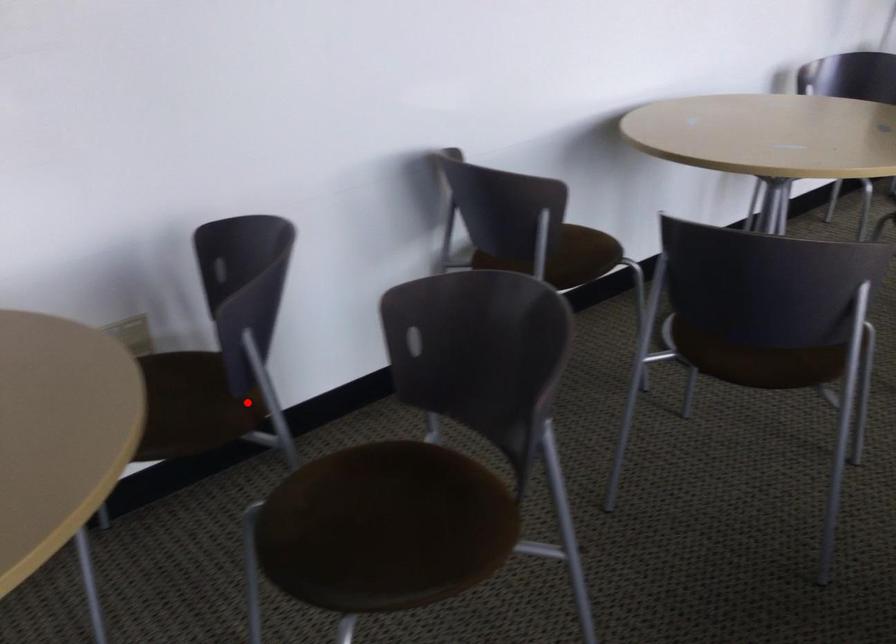
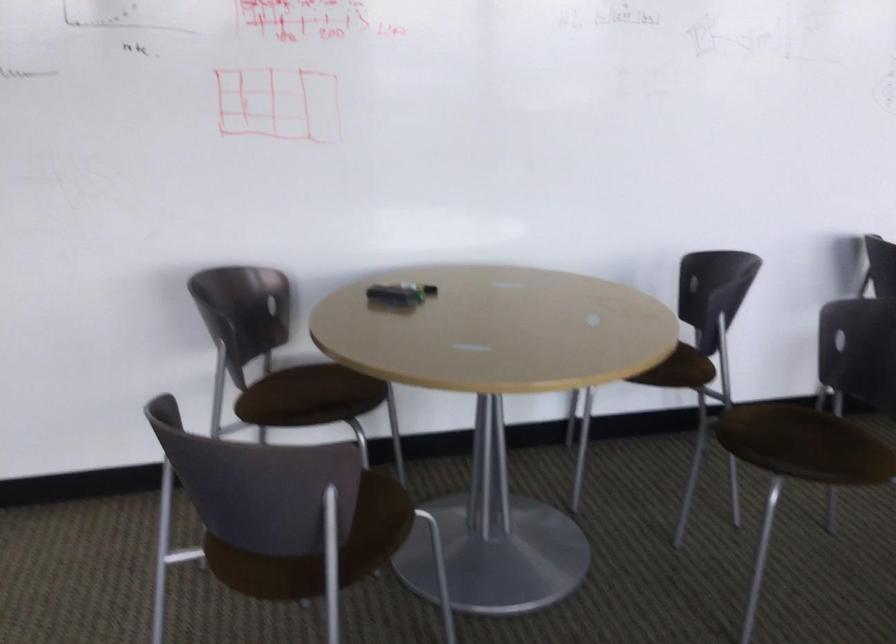
The point at the highlighted location is marked in the first image. Where is the corresponding point in the second image?

(690, 368)